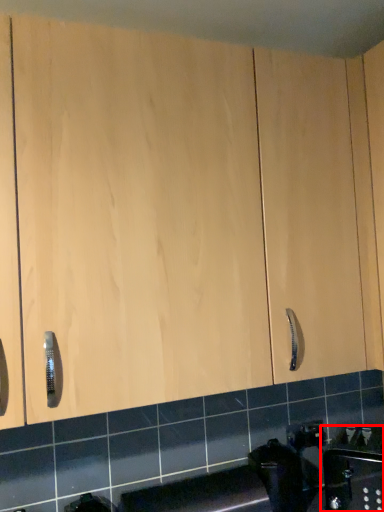
Question: From the image's perspective, what is the correct spatial positioning of sink (annotated by the red box) in reference to appliance?

Choices:
 (A) above
 (B) below

Answer: (A)